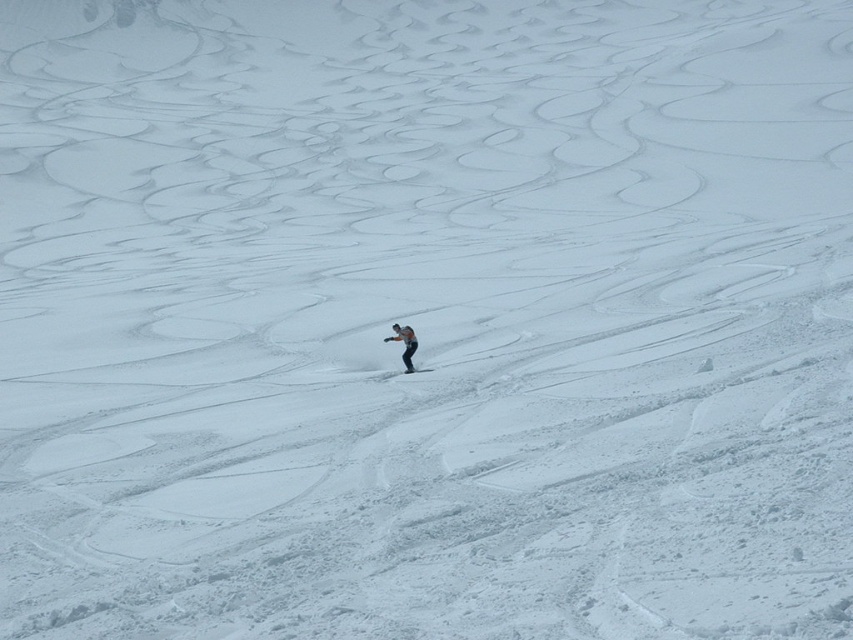
Which is below, gray fabric jacket at center or black matte ski at center?

black matte ski at center is lower down.

Does gray fabric jacket at center appear over black matte ski at center?

Yes.

I want to click on gray fabric jacket at center, so click(404, 342).

Locate an element on the screen. The image size is (853, 640). gray fabric jacket at center is located at coordinates (404, 342).